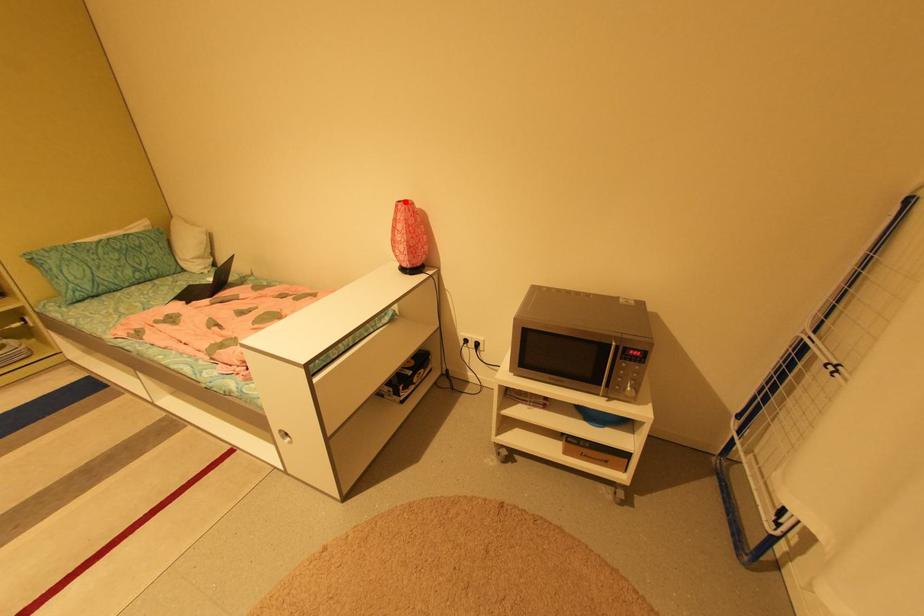
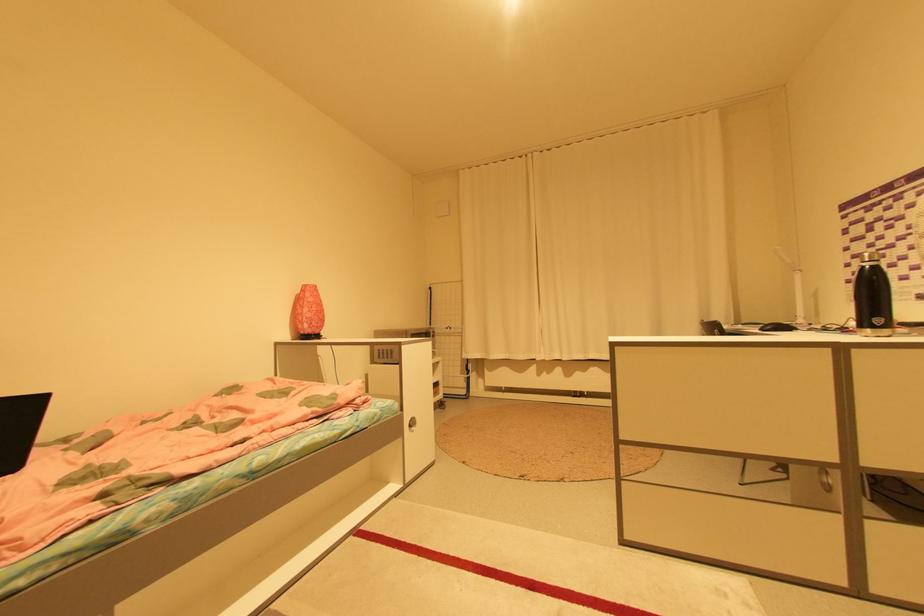
Locate, in the second image, the point that corresponds to the highlighted location in the first image.

(311, 285)